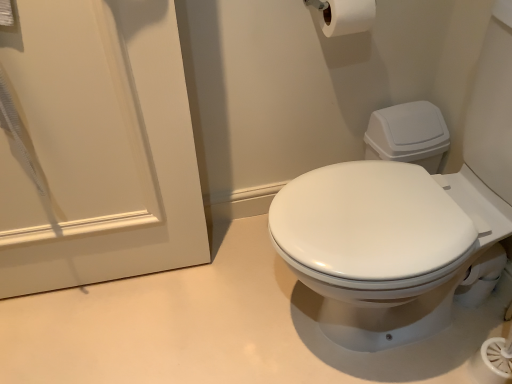
Question: Is white matte toilet paper at upper center bigger or smaller than white matte door at upper left?

Choices:
 (A) small
 (B) big

Answer: (A)

Question: In terms of height, does white matte toilet paper at upper center look taller or shorter compared to white matte door at upper left?

Choices:
 (A) tall
 (B) short

Answer: (B)

Question: From the image's perspective, relative to white matte door at upper left, is white matte toilet paper at upper center above or below?

Choices:
 (A) above
 (B) below

Answer: (A)

Question: From the image's perspective, is white matte door at upper left above or below white matte toilet paper at upper center?

Choices:
 (A) above
 (B) below

Answer: (B)

Question: From a real-world perspective, relative to white matte toilet paper at upper center, is white matte door at upper left vertically above or below?

Choices:
 (A) below
 (B) above

Answer: (A)

Question: Is white matte door at upper left wider or thinner than white matte toilet paper at upper center?

Choices:
 (A) thin
 (B) wide

Answer: (A)

Question: Considering their positions, is white matte door at upper left located in front of or behind white matte toilet paper at upper center?

Choices:
 (A) front
 (B) behind

Answer: (A)